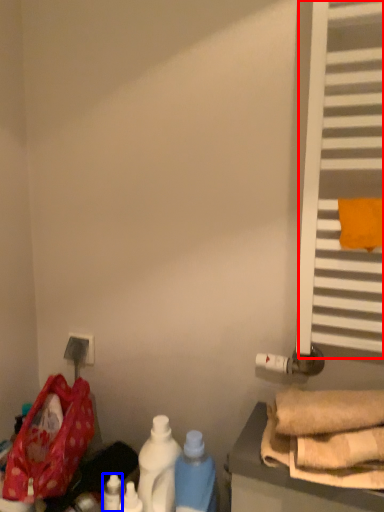
Question: Which object appears farthest to the camera in this image, window (highlighted by a red box) or bottle (highlighted by a blue box)?

Choices:
 (A) window
 (B) bottle

Answer: (B)